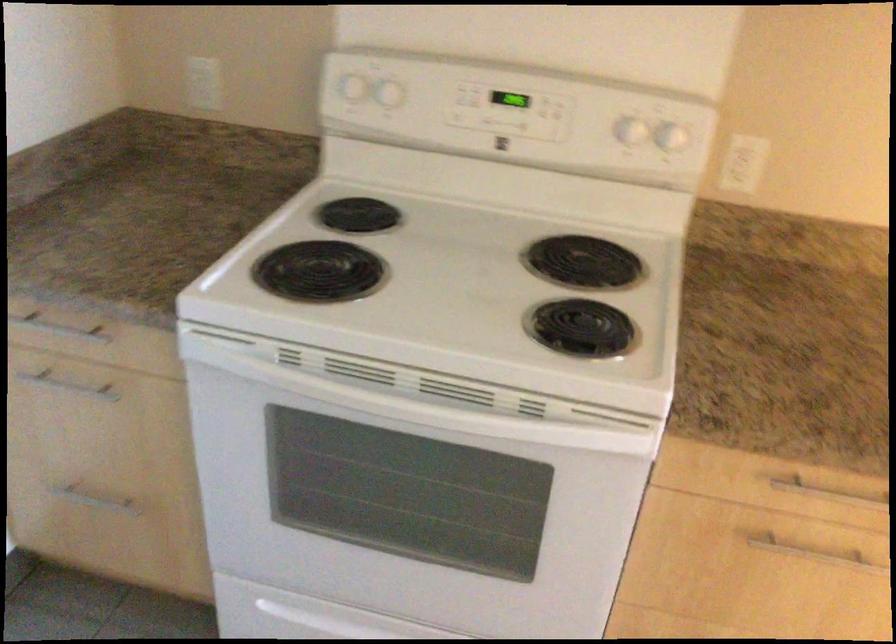
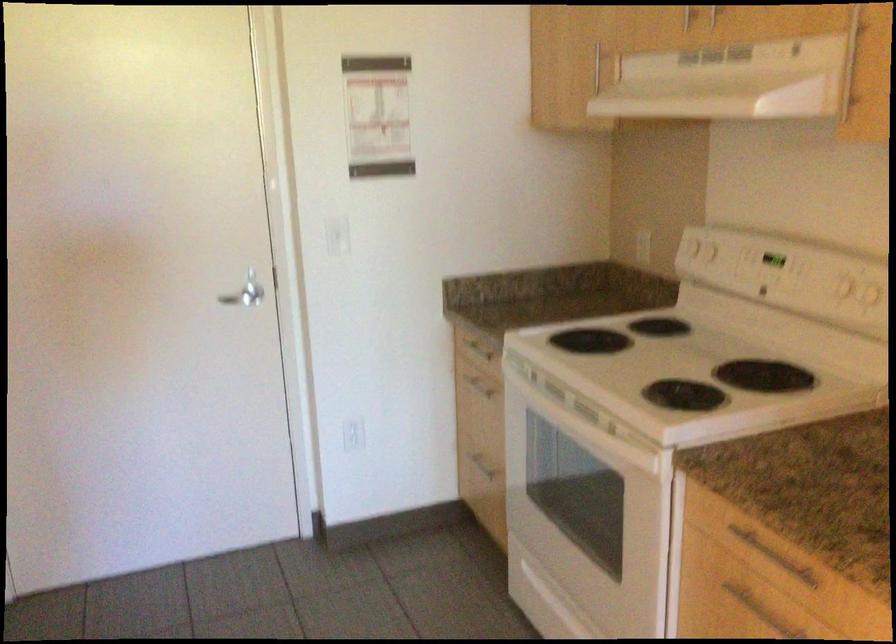
Where in the second image is the point corresponding to point (105, 498) from the first image?

(478, 462)